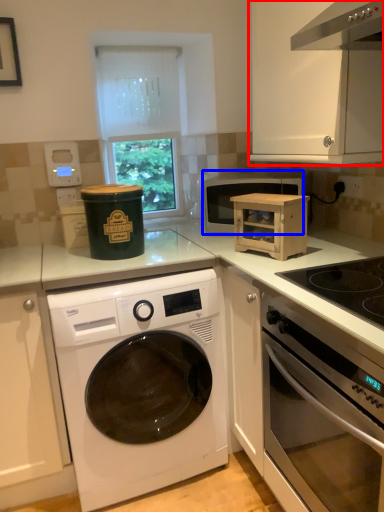
Question: Which object is further to the camera taking this photo, cabinetry (highlighted by a red box) or microwave oven (highlighted by a blue box)?

Choices:
 (A) cabinetry
 (B) microwave oven

Answer: (B)